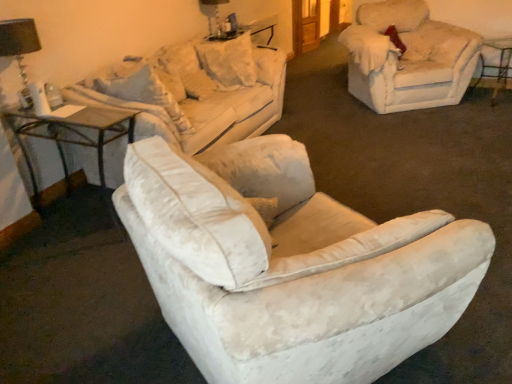
Question: Is fuzzy beige chair at upper right not near black fabric lampshade at upper left, the 2th table lamp when ordered from right to left?

Choices:
 (A) no
 (B) yes

Answer: (B)

Question: From the image's perspective, does fuzzy beige chair at upper right appear higher than black fabric lampshade at upper left, which is counted as the 2th table lamp, starting from the back?

Choices:
 (A) yes
 (B) no

Answer: (A)

Question: Is fuzzy beige chair at upper right wider than black fabric lampshade at upper left, the 1th table lamp from the bottom?

Choices:
 (A) yes
 (B) no

Answer: (A)

Question: Considering the relative positions of fuzzy beige chair at upper right and black fabric lampshade at upper left, which is counted as the 2th table lamp, starting from the back, in the image provided, is fuzzy beige chair at upper right to the right of black fabric lampshade at upper left, which is counted as the 2th table lamp, starting from the back, from the viewer's perspective?

Choices:
 (A) no
 (B) yes

Answer: (B)

Question: From a real-world perspective, is fuzzy beige chair at upper right located higher than black fabric lampshade at upper left, the 2th table lamp when ordered from right to left?

Choices:
 (A) no
 (B) yes

Answer: (A)

Question: Considering the relative sizes of fuzzy beige chair at upper right and black fabric lampshade at upper left, which is counted as the 2th table lamp, starting from the back, in the image provided, is fuzzy beige chair at upper right thinner than black fabric lampshade at upper left, which is counted as the 2th table lamp, starting from the back,?

Choices:
 (A) no
 (B) yes

Answer: (A)

Question: Could you tell me if black fabric lampshade at upper left, the 2th table lamp in the top-to-bottom sequence, is facing white velvety pillow at upper center, placed as the first pillow when sorted from left to right?

Choices:
 (A) yes
 (B) no

Answer: (B)

Question: Is black fabric lampshade at upper left, the 2th table lamp in the top-to-bottom sequence, surrounding white velvety pillow at upper center, placed as the first pillow when sorted from left to right?

Choices:
 (A) yes
 (B) no

Answer: (B)

Question: Considering the relative sizes of black fabric lampshade at upper left, the 2th table lamp when ordered from right to left, and white velvety pillow at upper center, placed as the first pillow when sorted from left to right, in the image provided, is black fabric lampshade at upper left, the 2th table lamp when ordered from right to left, thinner than white velvety pillow at upper center, placed as the first pillow when sorted from left to right,?

Choices:
 (A) no
 (B) yes

Answer: (B)

Question: Are black fabric lampshade at upper left, the 2th table lamp when ordered from right to left, and white velvety pillow at upper center, placed as the first pillow when sorted from left to right, located far from each other?

Choices:
 (A) yes
 (B) no

Answer: (A)

Question: Does black fabric lampshade at upper left, the 2th table lamp in the top-to-bottom sequence, lie behind white velvety pillow at upper center, placed as the first pillow when sorted from left to right?

Choices:
 (A) yes
 (B) no

Answer: (B)

Question: Does black fabric lampshade at upper left, the 1th table lamp from the bottom, have a greater width compared to white velvety pillow at upper center, the 2th pillow from the right?

Choices:
 (A) no
 (B) yes

Answer: (A)

Question: Is the position of fuzzy beige chair at upper right less distant than that of white velvety pillow at upper center, the 2th pillow from the right?

Choices:
 (A) yes
 (B) no

Answer: (B)